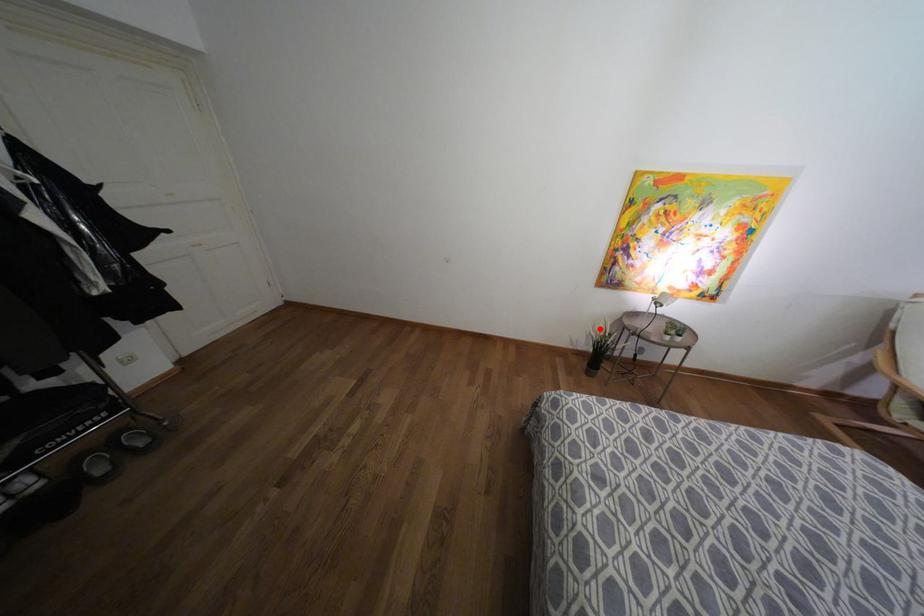
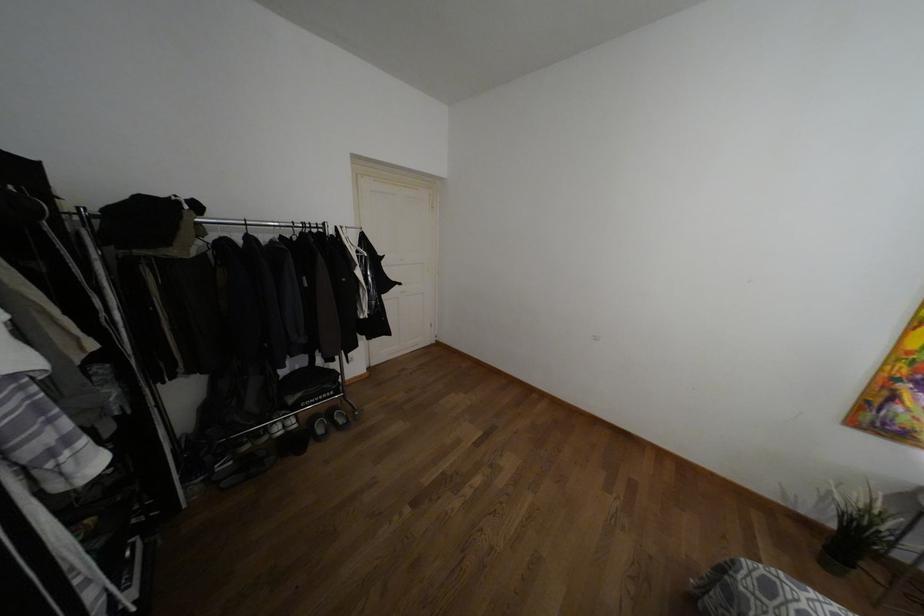
Question: I am providing you with two images of the same scene from different viewpoints. Given a red point in image1, look at the same physical point in image2. Is it:

Choices:
 (A) Closer to the viewpoint
 (B) Farther from the viewpoint

Answer: (B)